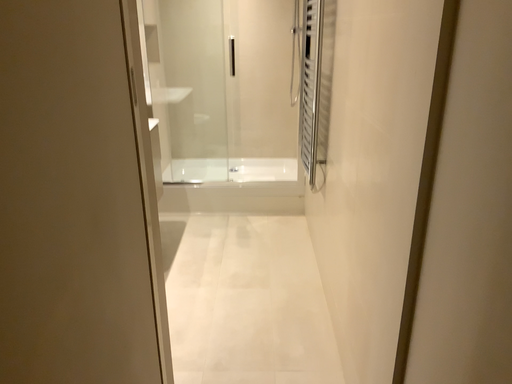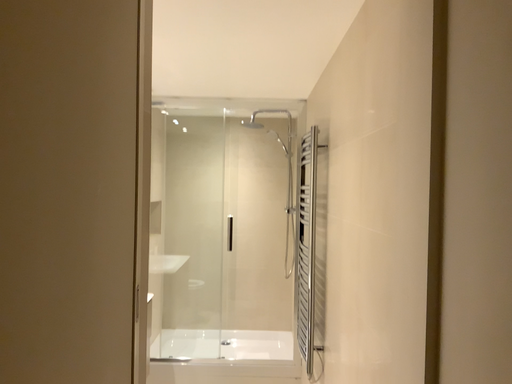
Question: Which way did the camera rotate in the video?

Choices:
 (A) rotated downward
 (B) rotated upward

Answer: (B)